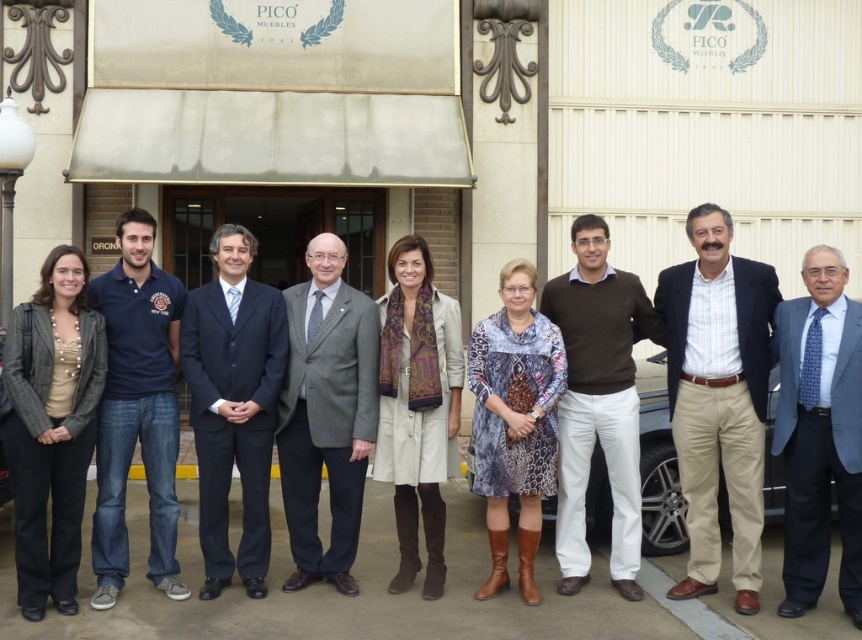
Does dark blue suit at center appear on the left side of blue cotton polo shirt at left?

Incorrect, dark blue suit at center is not on the left side of blue cotton polo shirt at left.

Describe the element at coordinates (233, 404) in the screenshot. I see `dark blue suit at center` at that location.

Identify the location of dark blue suit at center. The height and width of the screenshot is (640, 862). (233, 404).

Where is `dark blue suit at center`? The height and width of the screenshot is (640, 862). dark blue suit at center is located at coordinates (233, 404).

Does blue dotted tie at center come behind blue cotton polo shirt at left?

No, blue dotted tie at center is in front of blue cotton polo shirt at left.

Is blue dotted tie at center in front of blue cotton polo shirt at left?

Yes.

Image resolution: width=862 pixels, height=640 pixels. I want to click on blue dotted tie at center, so click(820, 433).

Which is more to the left, brown cotton pants at center or blue dotted tie at center?

brown cotton pants at center is more to the left.

Does brown cotton pants at center appear under blue dotted tie at center?

No.

Which is in front, point (714, 246) or point (822, 269)?

Point (822, 269) is in front.

Where is `brown cotton pants at center`? Image resolution: width=862 pixels, height=640 pixels. brown cotton pants at center is located at coordinates (717, 397).